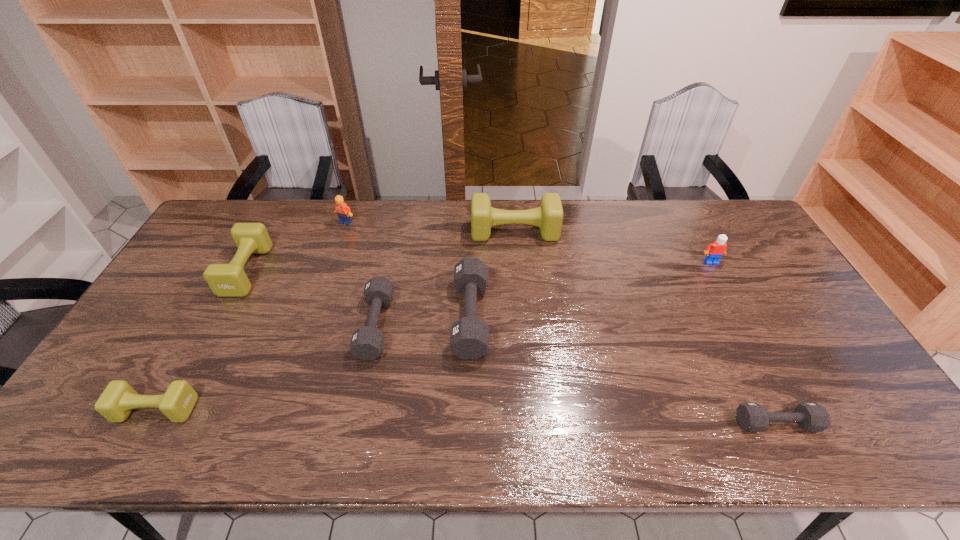
This screenshot has width=960, height=540. What are the coordinates of `the nearest olive dumbbell` in the screenshot? It's located at (118, 399).

The image size is (960, 540). In order to click on the shortest dumbbell in this screenshot , I will do (x=753, y=417).

Locate an element on the screen. the rightmost gray dumbbell is located at coordinates (753, 417).

The width and height of the screenshot is (960, 540). Find the location of `vacant space situated 0.220m on the right of the biggest olive dumbbell`. vacant space situated 0.220m on the right of the biggest olive dumbbell is located at coordinates (620, 232).

Find the location of a particular element. This screenshot has width=960, height=540. free space located on the front-facing side of the farther Lego is located at coordinates (321, 294).

Where is `free region located 0.280m on the face of the nearer Lego`? This screenshot has height=540, width=960. free region located 0.280m on the face of the nearer Lego is located at coordinates (750, 334).

The width and height of the screenshot is (960, 540). I want to click on vacant area situated 0.290m on the right of the second biggest olive dumbbell, so click(x=353, y=271).

The height and width of the screenshot is (540, 960). I want to click on vacant area located 0.050m on the left of the second gray dumbbell from right to left, so click(x=436, y=317).

What are the coordinates of `vacant space located on the back of the fourth object from left to right` in the screenshot? It's located at (391, 254).

The height and width of the screenshot is (540, 960). Identify the location of vacant space located on the right of the smallest olive dumbbell. (351, 409).